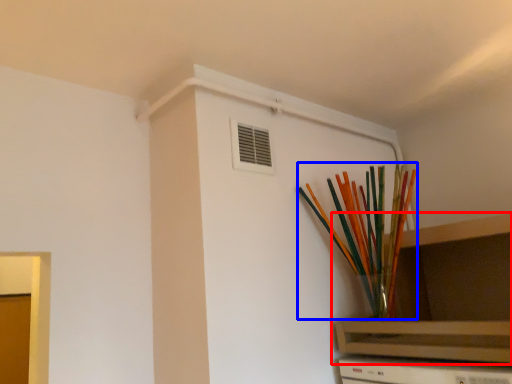
Question: Which object appears closest to the camera in this image, shelf (highlighted by a red box) or paint brush (highlighted by a blue box)?

Choices:
 (A) shelf
 (B) paint brush

Answer: (A)